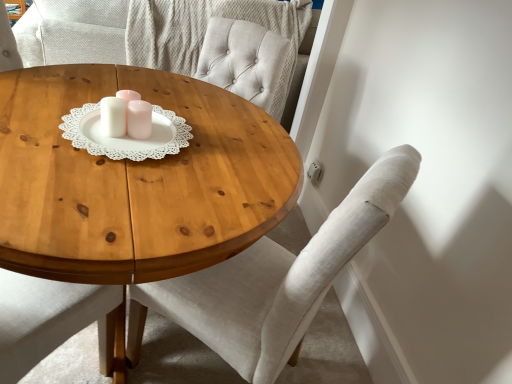
This screenshot has height=384, width=512. Identify the location of unoccupied space behind white glossy candle holder at center. (166, 103).